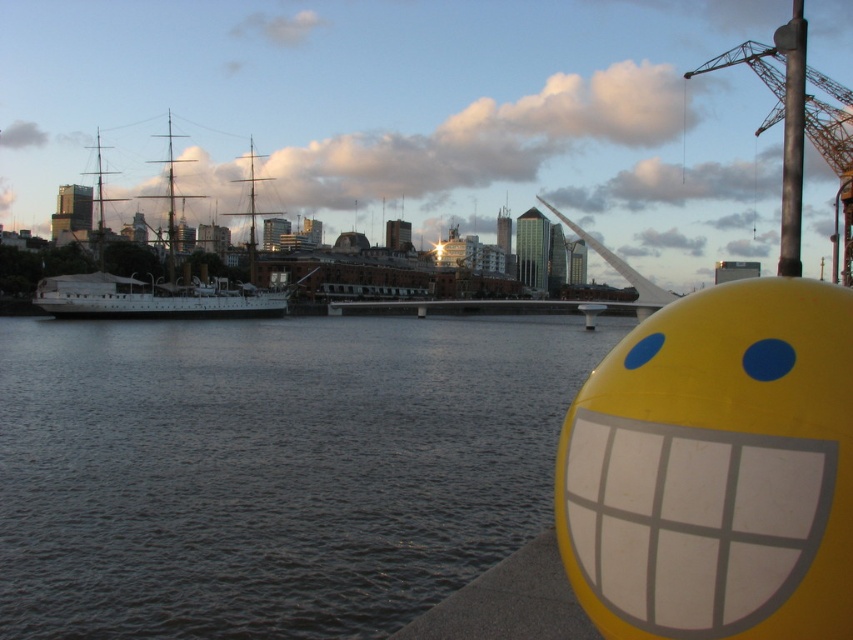
Question: Based on their relative distances, which object is nearer to the white wooden ship at left?

Choices:
 (A) rusty metal pole at upper right
 (B) metallic gray crane at upper right
 (C) dark gray water at lower left

Answer: (C)

Question: Which of the following is the farthest from the observer?

Choices:
 (A) (381, 595)
 (B) (782, 236)
 (C) (85, 284)
 (D) (845, 173)

Answer: (C)

Question: Estimate the real-world distances between objects in this image. Which object is closer to the rusty metal pole at upper right?

Choices:
 (A) metallic gray crane at upper right
 (B) dark gray water at lower left
 (C) white wooden ship at left

Answer: (A)

Question: Considering the relative positions of dark gray water at lower left and rusty metal pole at upper right in the image provided, where is dark gray water at lower left located with respect to rusty metal pole at upper right?

Choices:
 (A) above
 (B) below

Answer: (B)

Question: Can you confirm if metallic gray crane at upper right is positioned below rusty metal pole at upper right?

Choices:
 (A) no
 (B) yes

Answer: (B)

Question: Is dark gray water at lower left above metallic gray crane at upper right?

Choices:
 (A) yes
 (B) no

Answer: (B)